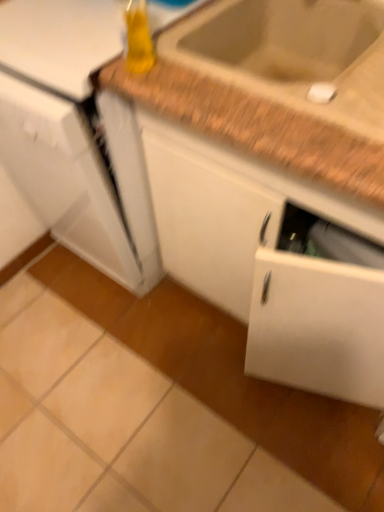
Identify the location of vacant area in front of translucent yellow bottle at upper center. (175, 96).